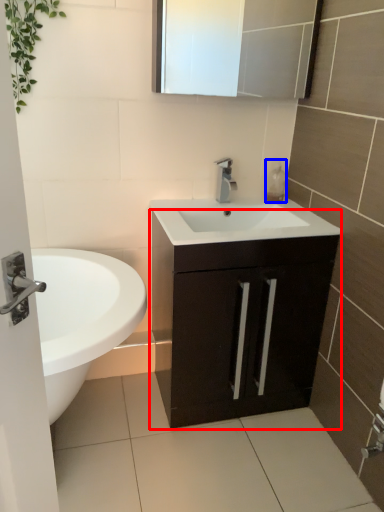
Question: Among these objects, which one is farthest to the camera, bathroom cabinet (highlighted by a red box) or soap dispenser (highlighted by a blue box)?

Choices:
 (A) bathroom cabinet
 (B) soap dispenser

Answer: (B)